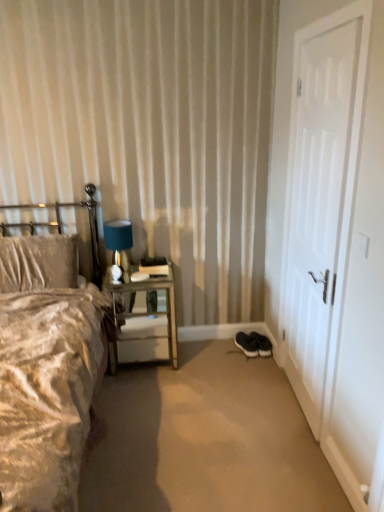
Question: From the image's perspective, relative to black suede sneakers at lower center, acting as the 2th footwear starting from the left, is black suede sneakers at lower right, arranged as the 2th footwear when viewed from the right, above or below?

Choices:
 (A) above
 (B) below

Answer: (B)

Question: Is black suede sneakers at lower right, arranged as the 2th footwear when viewed from the right, inside the boundaries of black suede sneakers at lower center, acting as the 2th footwear starting from the left, or outside?

Choices:
 (A) inside
 (B) outside

Answer: (B)

Question: Considering the real-world distances, which object is farthest from the white matte door at right?

Choices:
 (A) metallic silver nightstand at left
 (B) blue fabric lampshade at upper left
 (C) black suede sneakers at lower right, positioned as the first footwear in left-to-right order
 (D) metallic silver headboard at left
 (E) velvet beige bed at left

Answer: (D)

Question: Considering the real-world distances, which object is closest to the velvet beige bed at left?

Choices:
 (A) metallic silver nightstand at left
 (B) black suede sneakers at lower right, arranged as the 2th footwear when viewed from the right
 (C) blue fabric lampshade at upper left
 (D) black rubber shoes at lower right
 (E) white matte door at right

Answer: (A)